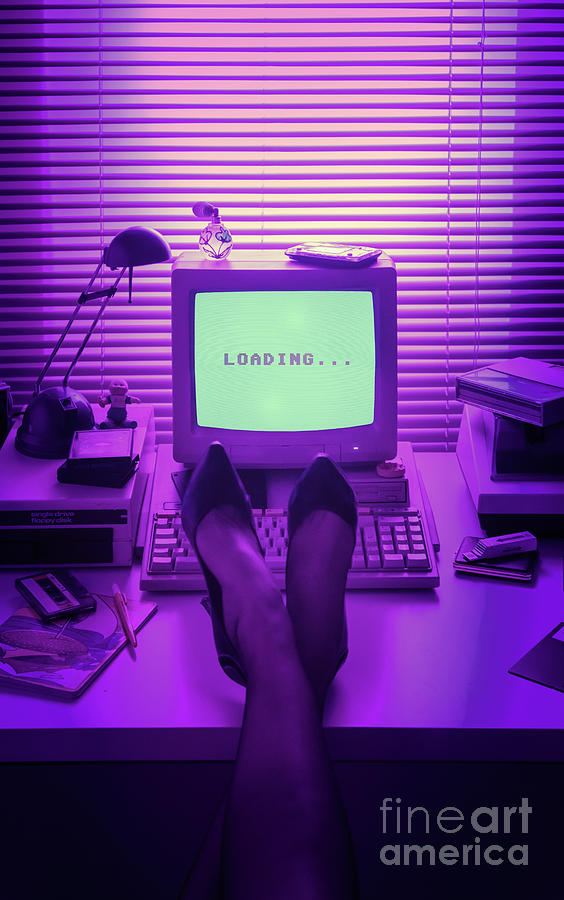
Find the location of a particular element. The width and height of the screenshot is (564, 900). pen is located at coordinates (122, 601), (127, 622).